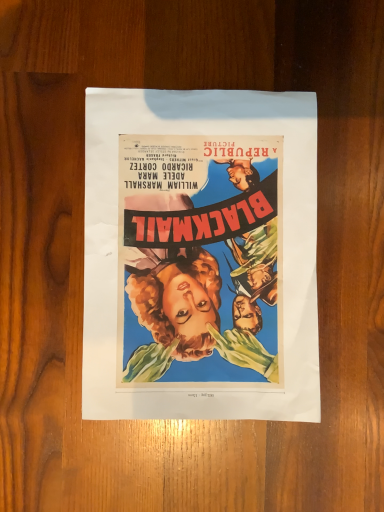
Describe the element at coordinates (283, 245) in the screenshot. The width and height of the screenshot is (384, 512). I see `vibrant paper poster at center` at that location.

You are a GUI agent. You are given a task and a screenshot of the screen. Output one action in this format:
    pyautogui.click(x=<x>, y=<y>)
    Task: Click on the vibrant paper poster at center
    
    Given the screenshot: What is the action you would take?
    283,245

Find the location of a particular element. This screenshot has width=384, height=512. vibrant paper poster at center is located at coordinates (283, 245).